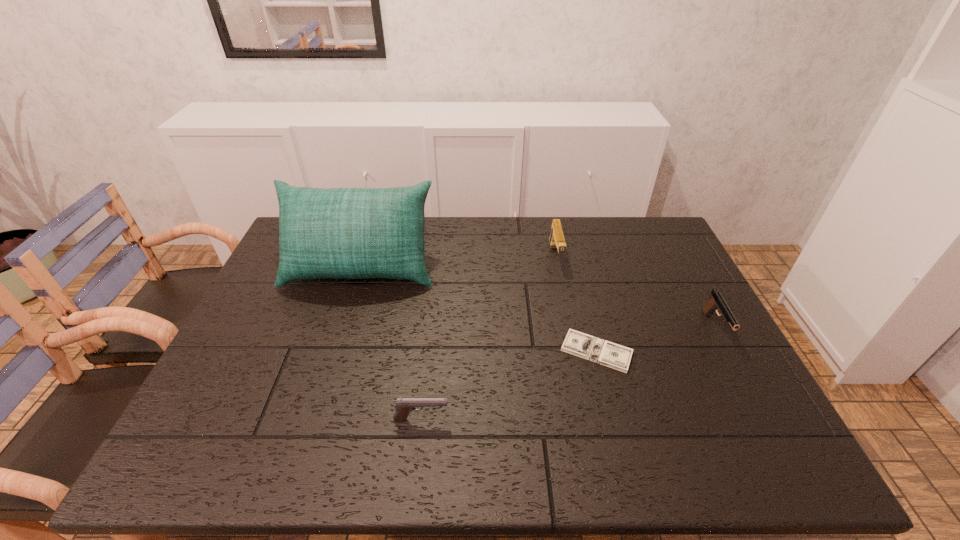
Identify the location of the tallest object. (348, 233).

Locate an element on the screen. The height and width of the screenshot is (540, 960). the fourth shortest object is located at coordinates (557, 240).

Locate an element on the screen. Image resolution: width=960 pixels, height=540 pixels. the farthest pistol is located at coordinates (557, 240).

This screenshot has width=960, height=540. In order to click on the second farthest pistol in this screenshot , I will do `click(716, 302)`.

Image resolution: width=960 pixels, height=540 pixels. In order to click on the rightmost object in this screenshot , I will do `click(716, 302)`.

At what (x,y) coordinates should I click in order to perform the action: click on the nearest pistol. Please return your answer as a coordinate pair (x, y). This screenshot has height=540, width=960. Looking at the image, I should click on (404, 406).

You are a GUI agent. You are given a task and a screenshot of the screen. Output one action in this format:
    pyautogui.click(x=<x>, y=<y>)
    Task: Click on the leftmost pistol
    The width and height of the screenshot is (960, 540).
    Given the screenshot: What is the action you would take?
    pyautogui.click(x=404, y=406)

What are the coordinates of `dollar` in the screenshot? It's located at (597, 350).

At what (x,y) coordinates should I click in order to perform the action: click on vacant space located 0.190m on the front-facing side of the tallest object. Please return your answer as a coordinate pair (x, y). Looking at the image, I should click on (336, 345).

Locate an element on the screen. The height and width of the screenshot is (540, 960). blank space located 0.050m at the barrel of the second tallest object is located at coordinates (561, 285).